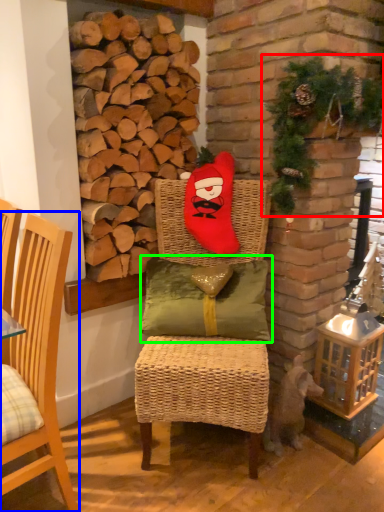
Question: Considering the real-world distances, which object is farthest from christmas decoration (highlighted by a red box)? chair (highlighted by a blue box) or pillow (highlighted by a green box)?

Choices:
 (A) chair
 (B) pillow

Answer: (A)